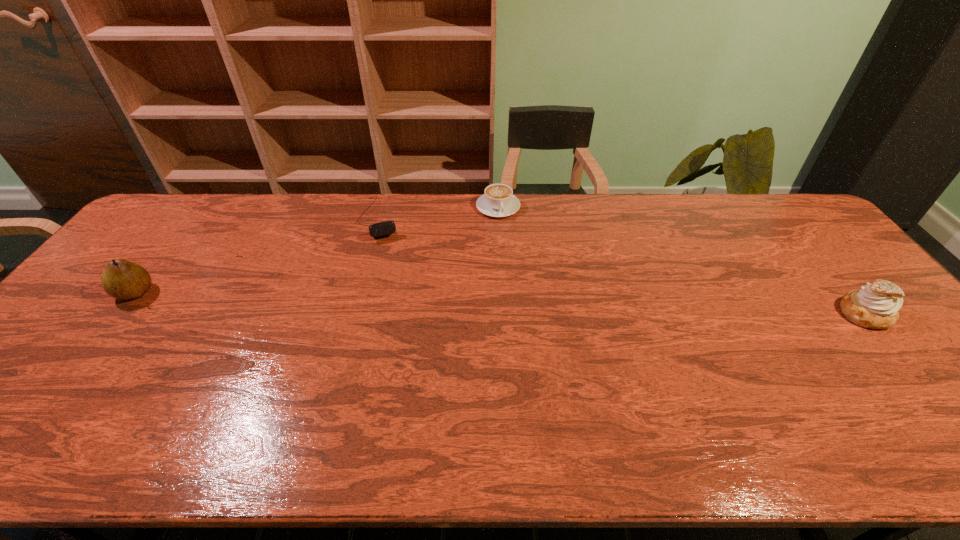
Identify the location of vacant region between the pear and the third object from left to right. The height and width of the screenshot is (540, 960). (317, 250).

Image resolution: width=960 pixels, height=540 pixels. Identify the location of empty space that is in between the cappuccino and the second tallest object. (682, 260).

Select which object appears as the closest to the pear. Please provide its 2D coordinates. Your answer should be formatted as a tuple, i.e. [(x, y)], where the tuple contains the x and y coordinates of a point satisfying the conditions above.

[(386, 228)]

The image size is (960, 540). I want to click on the closest object relative to the pastry, so click(x=498, y=200).

Where is `vacant space that satisfies the following two spatial constraints: 1. on the back side of the second object from left to right; 2. on the left side of the second object from right to left`? vacant space that satisfies the following two spatial constraints: 1. on the back side of the second object from left to right; 2. on the left side of the second object from right to left is located at coordinates (383, 207).

The height and width of the screenshot is (540, 960). Find the location of `free space that satisfies the following two spatial constraints: 1. on the front side of the webcam; 2. on the left side of the pastry`. free space that satisfies the following two spatial constraints: 1. on the front side of the webcam; 2. on the left side of the pastry is located at coordinates (354, 314).